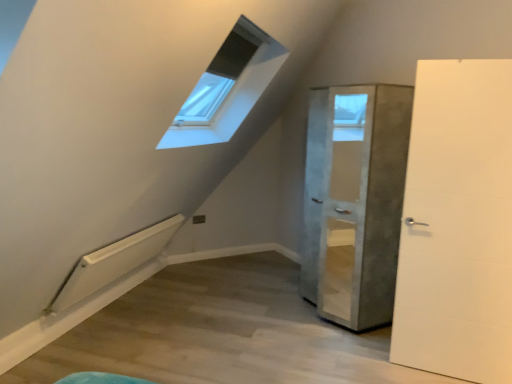
Question: From the image's perspective, is white matte door at right, which is the 1th door from front to back, located beneath concrete textured cabinet at center, the second door when ordered from front to back?

Choices:
 (A) yes
 (B) no

Answer: (A)

Question: Can you confirm if white matte door at right, marked as the 2th door in a back-to-front arrangement, is shorter than concrete textured cabinet at center, positioned as the 1th door in back-to-front order?

Choices:
 (A) no
 (B) yes

Answer: (A)

Question: Does white matte door at right, marked as the 2th door in a back-to-front arrangement, have a lesser width compared to concrete textured cabinet at center, positioned as the 1th door in back-to-front order?

Choices:
 (A) yes
 (B) no

Answer: (A)

Question: Is white matte door at right, which is the 1th door from front to back, bigger than concrete textured cabinet at center, the second door when ordered from front to back?

Choices:
 (A) no
 (B) yes

Answer: (A)

Question: From the image's perspective, is white matte door at right, marked as the 2th door in a back-to-front arrangement, on concrete textured cabinet at center, the second door when ordered from front to back?

Choices:
 (A) no
 (B) yes

Answer: (A)

Question: Is white matte door at right, marked as the 2th door in a back-to-front arrangement, at the left side of concrete textured cabinet at center, positioned as the 1th door in back-to-front order?

Choices:
 (A) no
 (B) yes

Answer: (A)

Question: From a real-world perspective, is concrete textured cabinet at center, the second door when ordered from front to back, below white matte door at right, which is the 1th door from front to back?

Choices:
 (A) no
 (B) yes

Answer: (B)

Question: Does concrete textured cabinet at center, positioned as the 1th door in back-to-front order, have a smaller size compared to white matte door at right, marked as the 2th door in a back-to-front arrangement?

Choices:
 (A) yes
 (B) no

Answer: (B)

Question: Would you say white matte door at right, which is the 1th door from front to back, is part of concrete textured cabinet at center, the second door when ordered from front to back,'s contents?

Choices:
 (A) yes
 (B) no

Answer: (B)

Question: Can you see concrete textured cabinet at center, positioned as the 1th door in back-to-front order, touching white matte door at right, which is the 1th door from front to back?

Choices:
 (A) yes
 (B) no

Answer: (B)

Question: Can you confirm if concrete textured cabinet at center, the second door when ordered from front to back, is taller than white matte door at right, which is the 1th door from front to back?

Choices:
 (A) yes
 (B) no

Answer: (B)

Question: Is concrete textured cabinet at center, positioned as the 1th door in back-to-front order, not close to white matte door at right, which is the 1th door from front to back?

Choices:
 (A) yes
 (B) no

Answer: (B)

Question: Considering the positions of point [459, 243] and point [305, 296], is point [459, 243] closer or farther from the camera than point [305, 296]?

Choices:
 (A) closer
 (B) farther

Answer: (A)